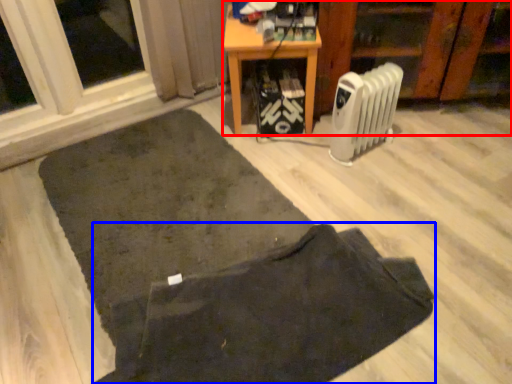
Question: Which point is further to the camera, furniture (highlighted by a red box) or doormat (highlighted by a blue box)?

Choices:
 (A) furniture
 (B) doormat

Answer: (A)